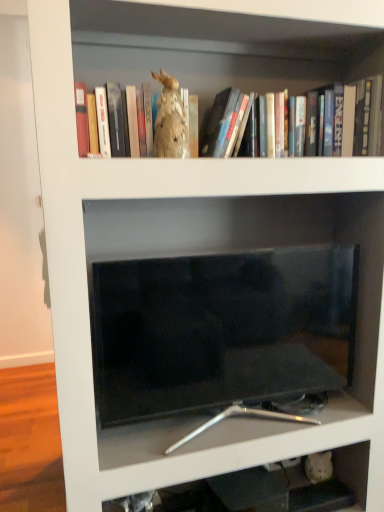
Question: From the image's perspective, does black glossy tv at center appear higher than matte gold statue at upper center?

Choices:
 (A) yes
 (B) no

Answer: (B)

Question: Is black glossy tv at center placed right next to matte gold statue at upper center?

Choices:
 (A) no
 (B) yes

Answer: (A)

Question: Does black glossy tv at center have a smaller size compared to matte gold statue at upper center?

Choices:
 (A) yes
 (B) no

Answer: (B)

Question: From a real-world perspective, is black glossy tv at center physically below matte gold statue at upper center?

Choices:
 (A) no
 (B) yes

Answer: (B)

Question: From a real-world perspective, is black glossy tv at center on matte gold statue at upper center?

Choices:
 (A) yes
 (B) no

Answer: (B)

Question: Is black glossy tv at center shorter than matte gold statue at upper center?

Choices:
 (A) yes
 (B) no

Answer: (B)

Question: Does black glossy tv at center touch beige fabric rabbit at upper center?

Choices:
 (A) no
 (B) yes

Answer: (A)

Question: From a real-world perspective, is black glossy tv at center physically below beige fabric rabbit at upper center?

Choices:
 (A) no
 (B) yes

Answer: (B)

Question: Is the position of black glossy tv at center more distant than that of beige fabric rabbit at upper center?

Choices:
 (A) yes
 (B) no

Answer: (A)

Question: Does black glossy tv at center have a greater width compared to beige fabric rabbit at upper center?

Choices:
 (A) no
 (B) yes

Answer: (B)

Question: Can you confirm if black glossy tv at center is thinner than beige fabric rabbit at upper center?

Choices:
 (A) yes
 (B) no

Answer: (B)

Question: From the image's perspective, would you say black glossy tv at center is positioned over beige fabric rabbit at upper center?

Choices:
 (A) yes
 (B) no

Answer: (B)

Question: Is matte gold statue at upper center bigger than beige fabric rabbit at upper center?

Choices:
 (A) no
 (B) yes

Answer: (B)